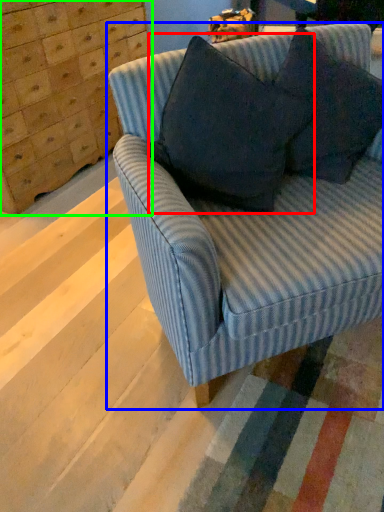
Question: Which object is positioned closest to throw pillow (highlighted by a red box)? Select from studio couch (highlighted by a blue box) and dresser (highlighted by a green box).

Choices:
 (A) studio couch
 (B) dresser

Answer: (A)